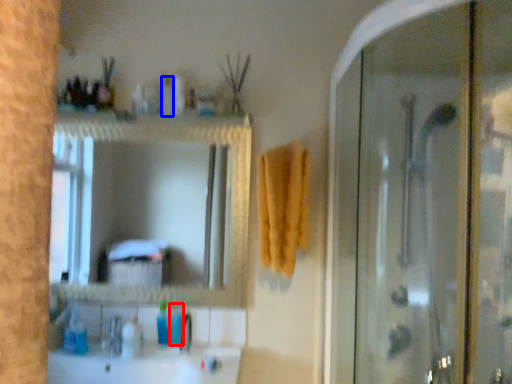
Question: Which point is closer to the camera, toiletry (highlighted by a red box) or toiletry (highlighted by a blue box)?

Choices:
 (A) toiletry
 (B) toiletry

Answer: (B)